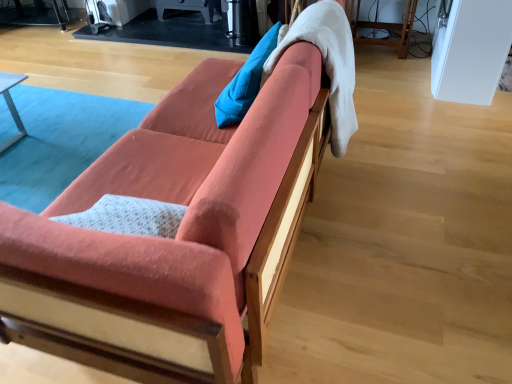
Based on the photo, measure the distance between point (191,234) and camera.

Point (191,234) and camera are 87.60 centimeters apart.

Identify the location of blue fabric pillow at upper center. Image resolution: width=512 pixels, height=384 pixels. (245, 82).

What do you see at coordinates (327, 63) in the screenshot?
I see `white soft blanket at upper right` at bounding box center [327, 63].

You are a GUI agent. You are given a task and a screenshot of the screen. Output one action in this format:
    pyautogui.click(x=<x>, y=<y>)
    Task: Click on the coral fabric couch at center
    
    Given the screenshot: What is the action you would take?
    pyautogui.click(x=183, y=240)

Consider the image. From a real-world perspective, between coral fabric couch at center and blue fabric pillow at upper center, who is vertically higher?

blue fabric pillow at upper center.

Does point (177, 117) appear closer or farther from the camera than point (273, 39)?

Point (177, 117).

Are coral fabric couch at center and blue fabric pillow at upper center located far from each other?

coral fabric couch at center is actually quite close to blue fabric pillow at upper center.

Does point (242, 106) lie in front of point (347, 134)?

Yes, point (242, 106) is closer to viewer.

Is blue fabric pillow at upper center outside of white soft blanket at upper right?

blue fabric pillow at upper center lies outside white soft blanket at upper right's area.

From the image's perspective, is blue fabric pillow at upper center above white soft blanket at upper right?

Correct, blue fabric pillow at upper center appears higher than white soft blanket at upper right in the image.

Which point is more distant from viewer, (x=219, y=109) or (x=170, y=189)?

The point (x=219, y=109) is farther.

From the image's perspective, which is below, blue fabric pillow at upper center or coral fabric couch at center?

From the image's view, coral fabric couch at center is below.

From a real-world perspective, is blue fabric pillow at upper center on top of coral fabric couch at center?

Yes, from a real-world perspective, blue fabric pillow at upper center is over coral fabric couch at center

Consider the image. How far apart are blue fabric pillow at upper center and coral fabric couch at center?

blue fabric pillow at upper center and coral fabric couch at center are 23.38 inches apart from each other.

Is white soft blanket at upper right beside blue fabric pillow at upper center?

No, white soft blanket at upper right is not making contact with blue fabric pillow at upper center.

Could blue fabric pillow at upper center be considered to be inside white soft blanket at upper right?

No, blue fabric pillow at upper center is not inside white soft blanket at upper right.

Considering the sizes of objects white soft blanket at upper right and blue fabric pillow at upper center in the image provided, who is wider, white soft blanket at upper right or blue fabric pillow at upper center?

white soft blanket at upper right is wider.

Does white soft blanket at upper right appear on the right side of coral fabric couch at center?

Indeed, white soft blanket at upper right is positioned on the right side of coral fabric couch at center.

In the scene shown: How different are the orientations of white soft blanket at upper right and coral fabric couch at center in degrees?

The angle between the facing direction of white soft blanket at upper right and the facing direction of coral fabric couch at center is 0.000606 degrees.

Does white soft blanket at upper right have a greater width compared to coral fabric couch at center?

No.

How distant is white soft blanket at upper right from coral fabric couch at center?

white soft blanket at upper right and coral fabric couch at center are 16.78 inches apart from each other.

At what (x,y) coordinates should I click in order to perform the action: click on blanket lying above the coral fabric couch at center (from the image's perspective). Please return your answer as a coordinate pair (x, y). The image size is (512, 384). Looking at the image, I should click on (327, 63).

How different are the orientations of coral fabric couch at center and white soft blanket at upper right in degrees?

coral fabric couch at center and white soft blanket at upper right are facing 0.000606 degrees away from each other.

From a real-world perspective, is coral fabric couch at center physically below white soft blanket at upper right?

Yes.

Is point (249, 215) behind point (343, 38)?

No, it is not.

Where is `pillow above the coral fabric couch at center (from the image's perspective)`? This screenshot has height=384, width=512. pillow above the coral fabric couch at center (from the image's perspective) is located at coordinates pyautogui.click(x=245, y=82).

The width and height of the screenshot is (512, 384). Identify the location of pillow behind the white soft blanket at upper right. click(245, 82).

Which object lies nearer to the anchor point white soft blanket at upper right, blue fabric pillow at upper center or coral fabric couch at center?

Among the two, blue fabric pillow at upper center is located nearer to white soft blanket at upper right.

From the image, which object appears to be farther from coral fabric couch at center, blue fabric pillow at upper center or white soft blanket at upper right?

blue fabric pillow at upper center.

From the image, which object appears to be farther from blue fabric pillow at upper center, coral fabric couch at center or white soft blanket at upper right?

coral fabric couch at center.

When comparing their distances from white soft blanket at upper right, does coral fabric couch at center or blue fabric pillow at upper center seem further?

coral fabric couch at center is further to white soft blanket at upper right.

From the image, which object appears to be nearer to blue fabric pillow at upper center, white soft blanket at upper right or coral fabric couch at center?

white soft blanket at upper right.

When comparing their distances from coral fabric couch at center, does white soft blanket at upper right or blue fabric pillow at upper center seem closer?

white soft blanket at upper right is closer to coral fabric couch at center.

This screenshot has height=384, width=512. I want to click on blanket positioned between coral fabric couch at center and blue fabric pillow at upper center from near to far, so click(327, 63).